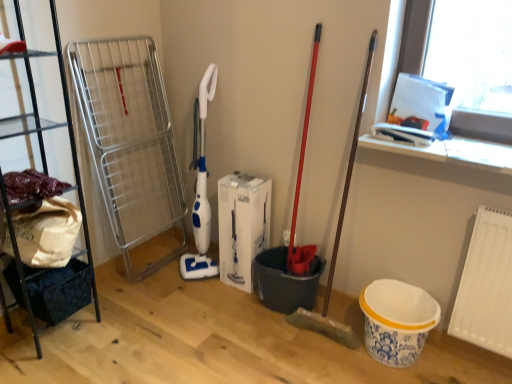
Question: Is black metal shelf at left positioned before white matte radiator at lower right?

Choices:
 (A) yes
 (B) no

Answer: (A)

Question: Is black metal shelf at left thinner than white matte radiator at lower right?

Choices:
 (A) yes
 (B) no

Answer: (B)

Question: Is the position of black metal shelf at left more distant than that of white matte radiator at lower right?

Choices:
 (A) yes
 (B) no

Answer: (B)

Question: Is black metal shelf at left far away from white matte radiator at lower right?

Choices:
 (A) yes
 (B) no

Answer: (A)

Question: From the image's perspective, is black metal shelf at left located beneath white matte radiator at lower right?

Choices:
 (A) yes
 (B) no

Answer: (B)

Question: From a real-world perspective, is black metal shelf at left under white matte radiator at lower right?

Choices:
 (A) no
 (B) yes

Answer: (A)

Question: From the image's perspective, is dark blue fabric basket at lower left located above black metal shelf at left?

Choices:
 (A) yes
 (B) no

Answer: (B)

Question: Is dark blue fabric basket at lower left thinner than black metal shelf at left?

Choices:
 (A) no
 (B) yes

Answer: (B)

Question: Is dark blue fabric basket at lower left completely or partially outside of black metal shelf at left?

Choices:
 (A) yes
 (B) no

Answer: (B)

Question: Is dark blue fabric basket at lower left looking in the opposite direction of black metal shelf at left?

Choices:
 (A) yes
 (B) no

Answer: (A)

Question: Is dark blue fabric basket at lower left to the left of black metal shelf at left from the viewer's perspective?

Choices:
 (A) no
 (B) yes

Answer: (A)

Question: Is dark blue fabric basket at lower left to the right of black metal shelf at left from the viewer's perspective?

Choices:
 (A) yes
 (B) no

Answer: (A)

Question: From the image's perspective, is white matte radiator at lower right below dark blue fabric basket at lower left?

Choices:
 (A) yes
 (B) no

Answer: (B)